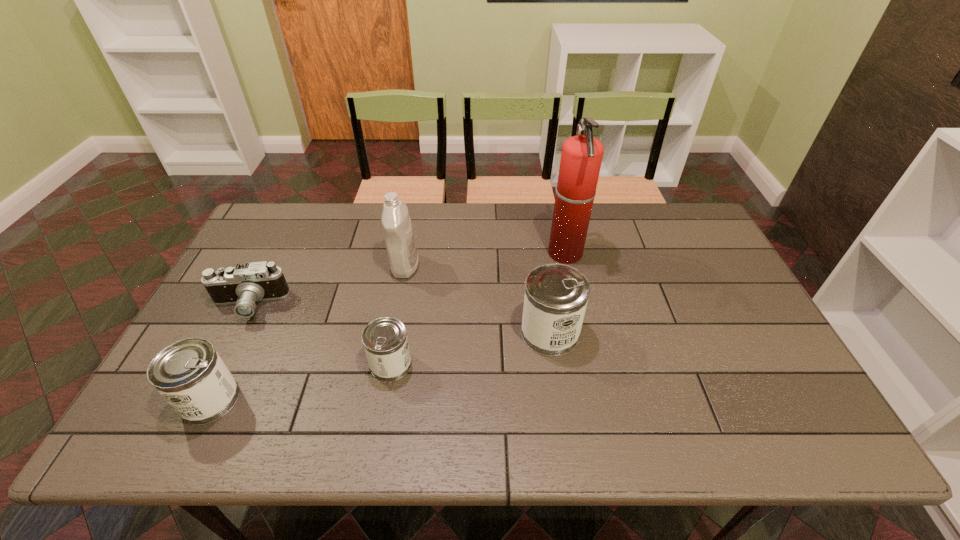
Identify the location of the second shortest can. (191, 376).

Where is `the fourth tallest object`? The width and height of the screenshot is (960, 540). the fourth tallest object is located at coordinates (191, 376).

This screenshot has height=540, width=960. I want to click on the second can from right to left, so click(x=385, y=341).

Find the location of `the rightmost can`. the rightmost can is located at coordinates tap(556, 295).

Locate an element on the screen. This screenshot has height=540, width=960. the third tallest object is located at coordinates (556, 295).

Locate an element on the screen. The image size is (960, 540). the second tallest object is located at coordinates (399, 239).

Locate an element on the screen. The image size is (960, 540). fire extinguisher is located at coordinates (581, 157).

Locate an element on the screen. camera is located at coordinates (243, 285).

The image size is (960, 540). I want to click on free point located 0.350m on the back of the leftmost can, so click(x=271, y=277).

At what (x,y) coordinates should I click in order to perform the action: click on free space located on the left of the second can from right to left. Please return your answer as a coordinate pair (x, y). Looking at the image, I should click on (243, 364).